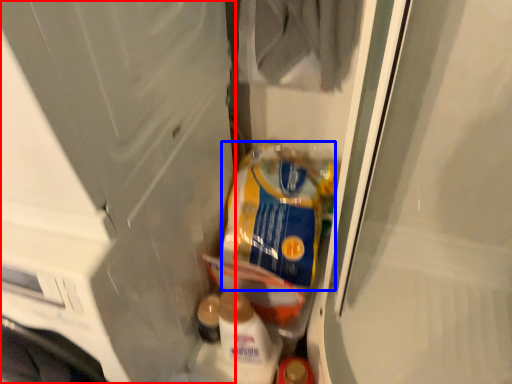
Question: Which of the following is the farthest to the observer, screen door (highlighted by a red box) or product (highlighted by a blue box)?

Choices:
 (A) screen door
 (B) product

Answer: (B)